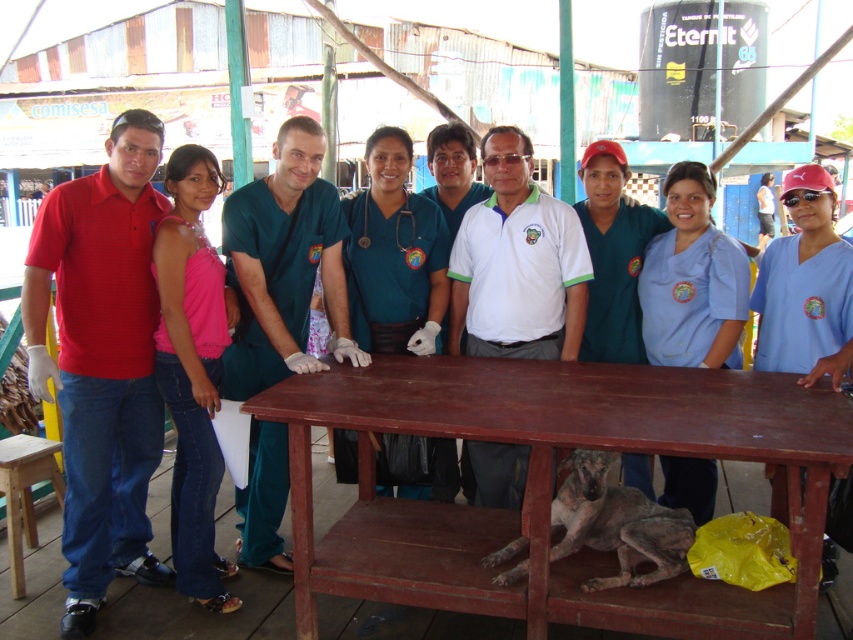
Based on the photo, you are organizing a small veterinary workshop and need to seat 4 people around the brown wooden table at center. There is also a light brown wooden stool at lower left available. Considering the size of the table and stool, can the stool be placed at the table to accommodate an additional person?

The brown wooden table at center is wider than the light brown wooden stool at lower left, so the stool can be placed at the table to accommodate an additional person since the table has enough space to accommodate it.

You are organizing a photo shoot for a veterinary clinic brochure and need to ensure that the clothing items in the photo are correctly sized for the models. Given that the pink fabric top at left and the light blue scrubs at center are part of the current setup, which clothing item is narrower in width?

The pink fabric top at left is narrower in width compared to the light blue scrubs at center.